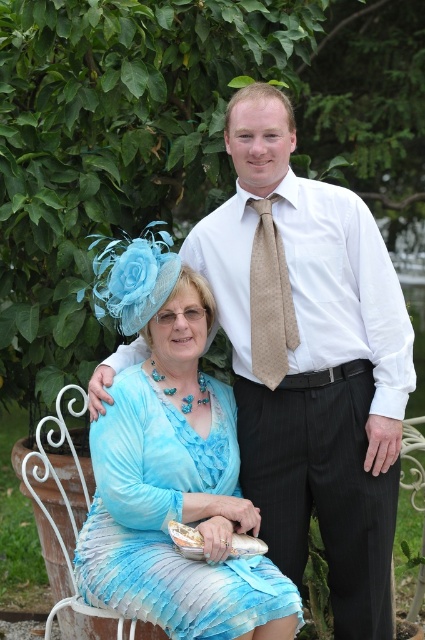
From the picture: Can you confirm if white shirt at center is smaller than beige dotted tie at center?

Incorrect, white shirt at center is not smaller in size than beige dotted tie at center.

Consider the image. Who is lower down, white shirt at center or beige dotted tie at center?

Positioned lower is white shirt at center.

The image size is (425, 640). I want to click on white shirt at center, so click(x=311, y=358).

How much distance is there between white shirt at center and light blue chiffon dress at lower left?

white shirt at center and light blue chiffon dress at lower left are 18.34 inches apart.

Does white shirt at center have a larger size compared to light blue chiffon dress at lower left?

Yes, white shirt at center is bigger than light blue chiffon dress at lower left.

Identify the location of white shirt at center. The width and height of the screenshot is (425, 640). point(311,358).

Does point (113, 464) come closer to viewer compared to point (283, 330)?

Yes, it is in front of point (283, 330).

Between light blue chiffon dress at lower left and beige dotted tie at center, which one appears on the right side from the viewer's perspective?

beige dotted tie at center is more to the right.

Locate an element on the screen. The width and height of the screenshot is (425, 640). light blue chiffon dress at lower left is located at coordinates (169, 518).

Locate an element on the screen. The height and width of the screenshot is (640, 425). light blue chiffon dress at lower left is located at coordinates (169, 518).